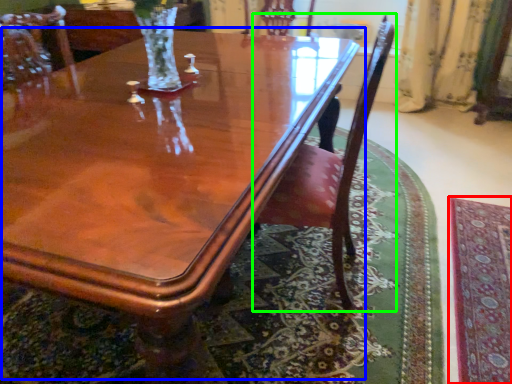
Question: Estimate the real-world distances between objects in this image. Which object is closer to mat (highlighted by a red box), coffee table (highlighted by a blue box) or chair (highlighted by a green box)?

Choices:
 (A) coffee table
 (B) chair

Answer: (B)